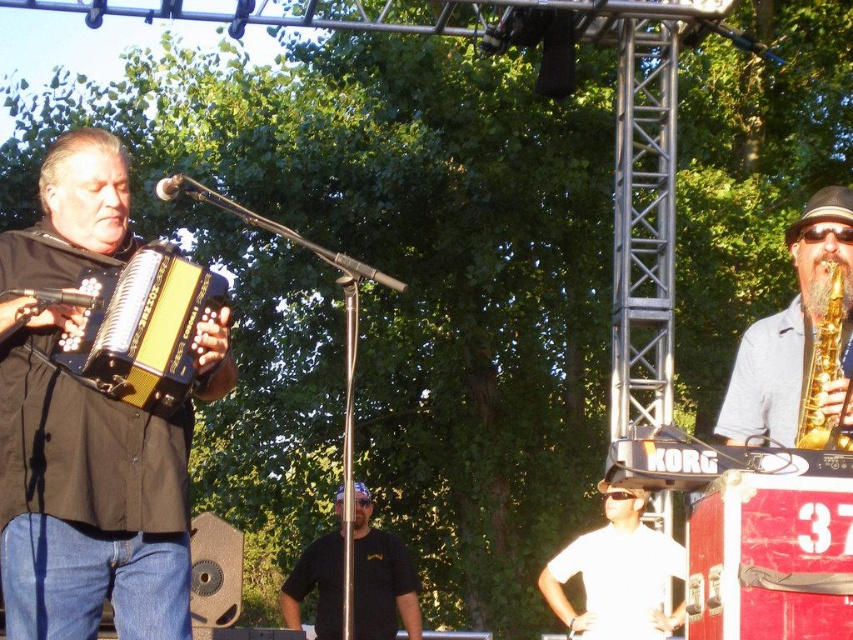
You are a photographer standing at the camera position. You want to capture a closeup shot of the matte yellow accordion at left. Given that you are 32.51 feet away from it, is this distance suitable for a clear closeup photo?

The matte yellow accordion at left and camera are 32.51 feet apart. This distance may be too far for a clear closeup photo, as typical closeup shots require the subject to be within a few feet of the camera lens.